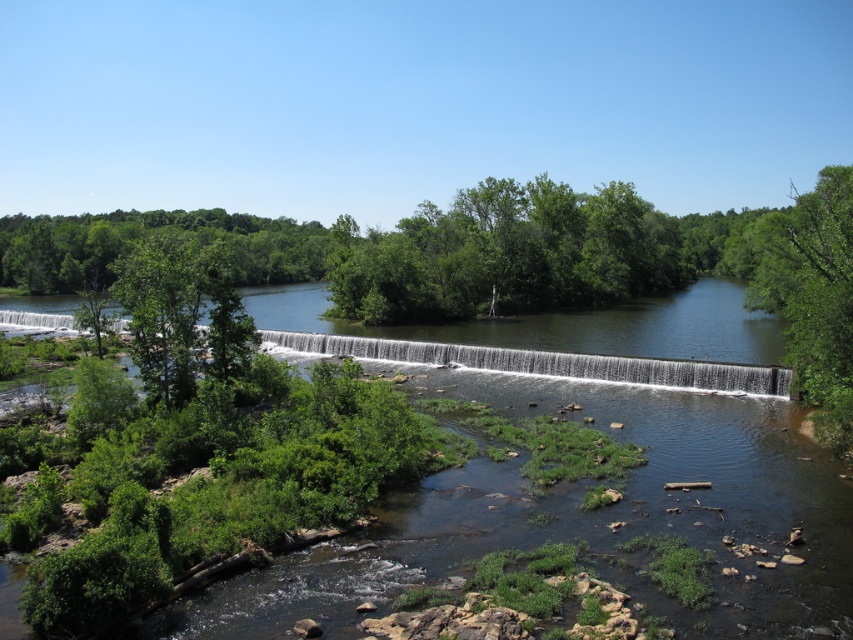
Question: Which of these objects is positioned closest to the green leafy tree at right?

Choices:
 (A) green leafy trees at upper left
 (B) smooth concrete dam at center

Answer: (B)

Question: Can you confirm if green leafy tree at right is positioned below green leafy trees at upper left?

Choices:
 (A) no
 (B) yes

Answer: (A)

Question: Is green leafy tree at right above smooth concrete dam at center?

Choices:
 (A) no
 (B) yes

Answer: (B)

Question: Which point is farther to the camera?

Choices:
 (A) green leafy tree at right
 (B) smooth concrete dam at center
 (C) green leafy trees at upper left

Answer: (B)

Question: From the image, what is the correct spatial relationship of green leafy tree at right in relation to smooth concrete dam at center?

Choices:
 (A) left
 (B) right

Answer: (B)

Question: Which point is farther from the camera taking this photo?

Choices:
 (A) pos(822,387)
 (B) pos(689,372)

Answer: (B)